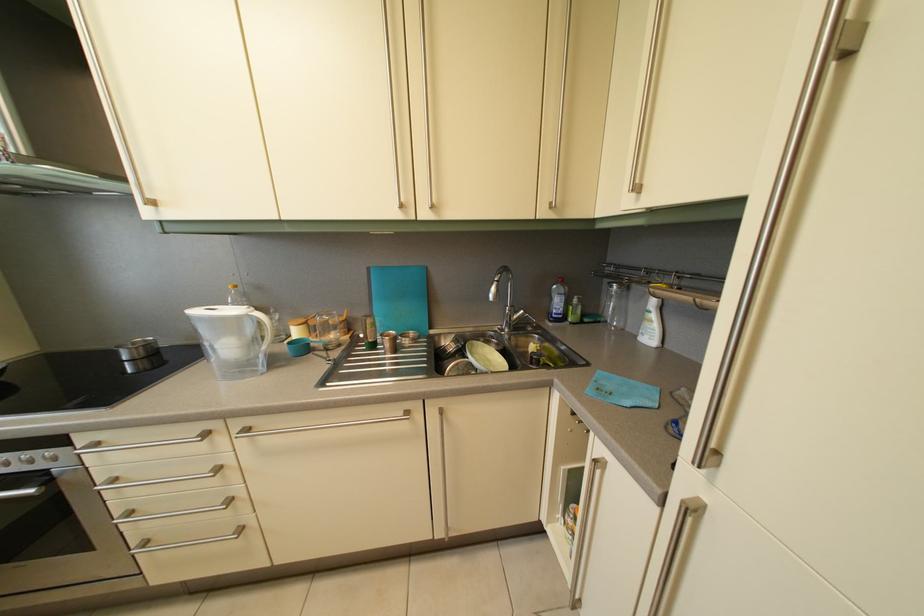
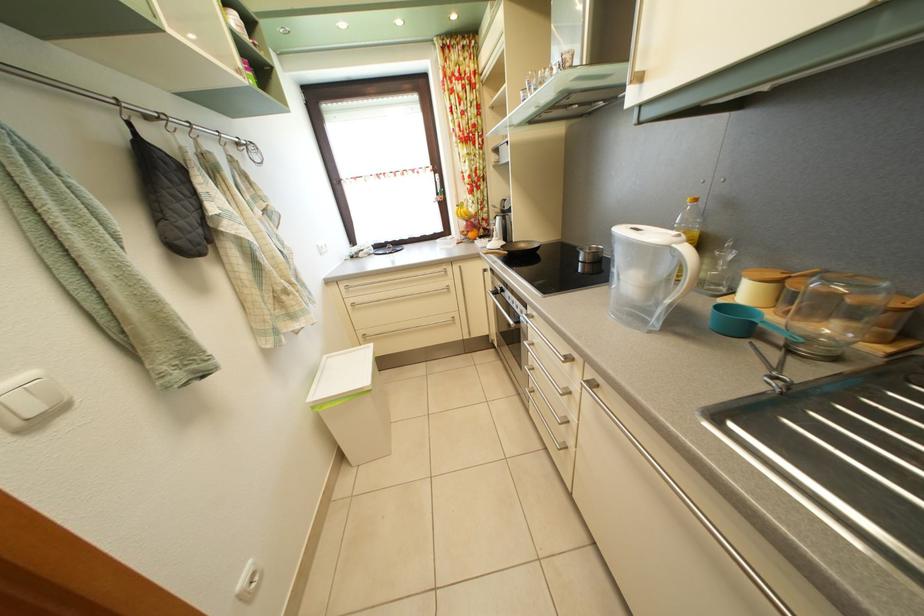
From the picture: First-person continuous shooting, in which direction is the camera rotating?

The camera rotated toward left-down.